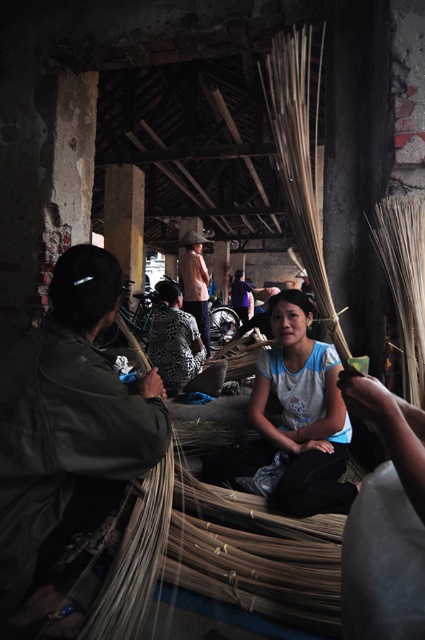
Question: Based on their relative distances, which object is farther from the light brown woven hat at upper center?

Choices:
 (A) printed fabric shirt at center
 (B) dark green leather jacket at left
 (C) blue cotton shirt at center

Answer: (B)

Question: Which object is the closest to the printed fabric shirt at center?

Choices:
 (A) dark green leather jacket at left
 (B) light brown woven hat at upper center
 (C) blue cotton shirt at center

Answer: (B)

Question: Among these points, which one is nearest to the camera?

Choices:
 (A) (328, 426)
 (B) (166, 349)
 (C) (11, 362)

Answer: (C)

Question: Can you confirm if dark green leather jacket at left is positioned to the right of printed fabric shirt at center?

Choices:
 (A) yes
 (B) no

Answer: (A)

Question: Does blue cotton shirt at center have a larger size compared to printed fabric shirt at center?

Choices:
 (A) no
 (B) yes

Answer: (A)

Question: Is dark green leather jacket at left further to camera compared to blue cotton shirt at center?

Choices:
 (A) yes
 (B) no

Answer: (B)